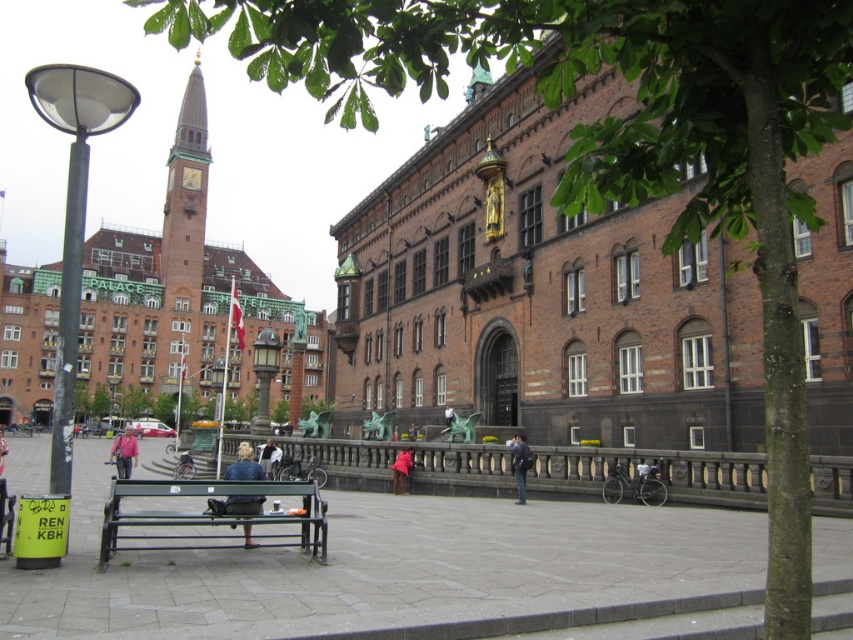
Question: Which of the following is the farthest from the observer?

Choices:
 (A) (117, 476)
 (B) (236, 509)

Answer: (A)

Question: Which object is the closest to the denim jacket at lower left?

Choices:
 (A) pink fabric coat at center
 (B) wooden bench at lower left

Answer: (B)

Question: Estimate the real-world distances between objects in this image. Which object is closer to the pink fabric coat at center?

Choices:
 (A) matte black lamp post at left
 (B) dark blue jeans at center
 (C) pink fabric jacket at lower left

Answer: (B)

Question: Observing the image, what is the correct spatial positioning of metallic green bench at center in reference to wooden bench at lower left?

Choices:
 (A) above
 (B) below

Answer: (B)

Question: Considering the relative positions of polished brass lamp post at center and denim jacket at lower left in the image provided, where is polished brass lamp post at center located with respect to denim jacket at lower left?

Choices:
 (A) right
 (B) left

Answer: (A)

Question: Can you confirm if polished brass lamp post at center is positioned below pink fabric jacket at lower left?

Choices:
 (A) yes
 (B) no

Answer: (B)